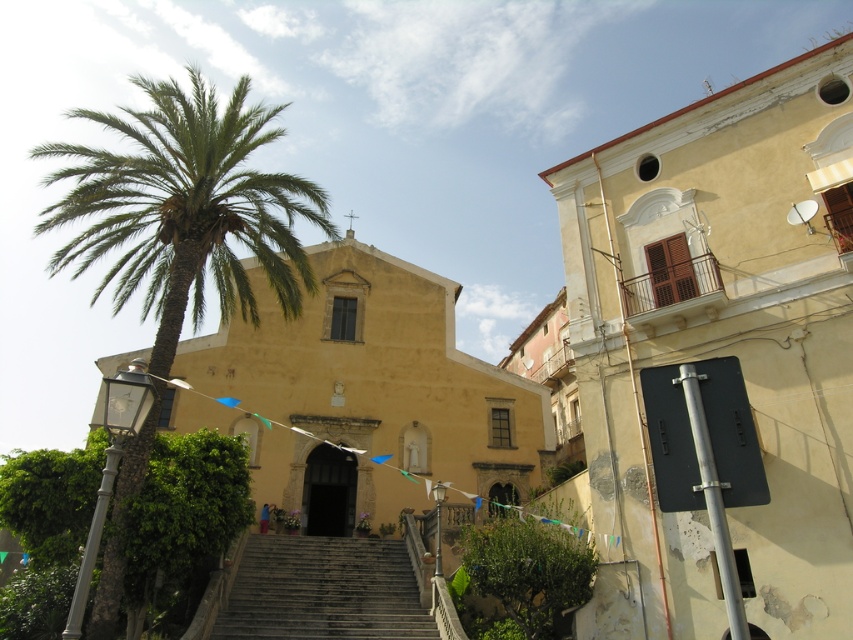
Question: Is yellow matte building at upper right below green leafy palm at left?

Choices:
 (A) no
 (B) yes

Answer: (B)

Question: Is yellow matte building at upper right below green leafy palm at left?

Choices:
 (A) yes
 (B) no

Answer: (A)

Question: Which of the following is the closest to the observer?

Choices:
 (A) (332, 579)
 (B) (795, 164)

Answer: (B)

Question: Can you confirm if yellow matte building at upper right is positioned to the left of dark gray stone stairs at center?

Choices:
 (A) no
 (B) yes

Answer: (A)

Question: Which object is the farthest from the yellow matte building at upper right?

Choices:
 (A) green leafy palm at left
 (B) dark gray stone stairs at center

Answer: (A)

Question: Among these objects, which one is farthest from the camera?

Choices:
 (A) green leafy palm at left
 (B) dark gray stone stairs at center
 (C) yellow matte building at upper right

Answer: (B)